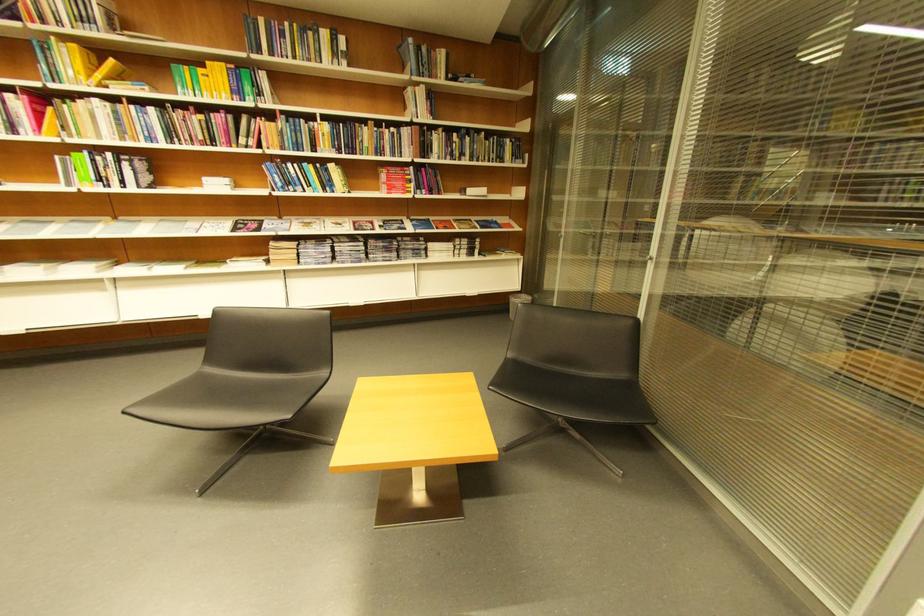
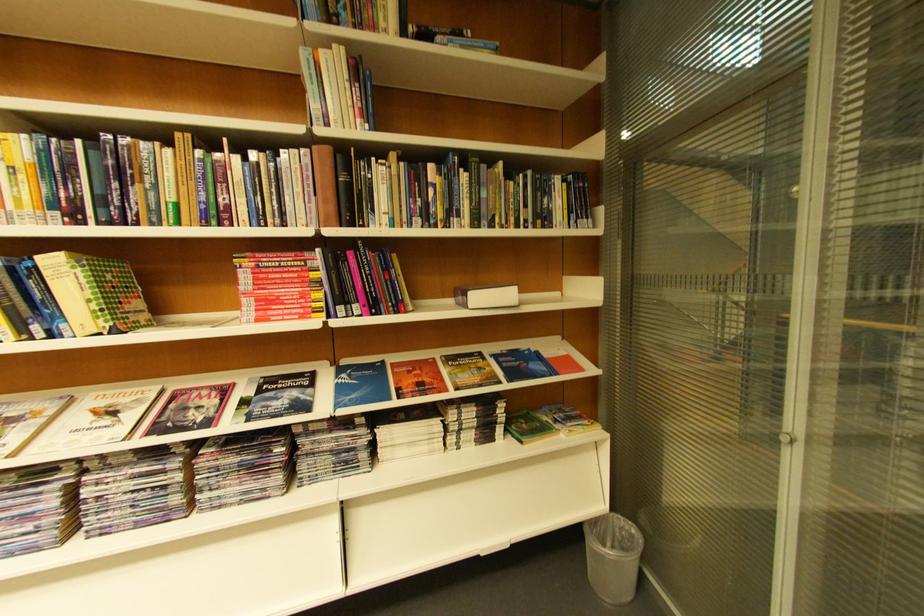
In the second image, find the point that corresponds to the point at 446,79 in the first image.

(384, 31)